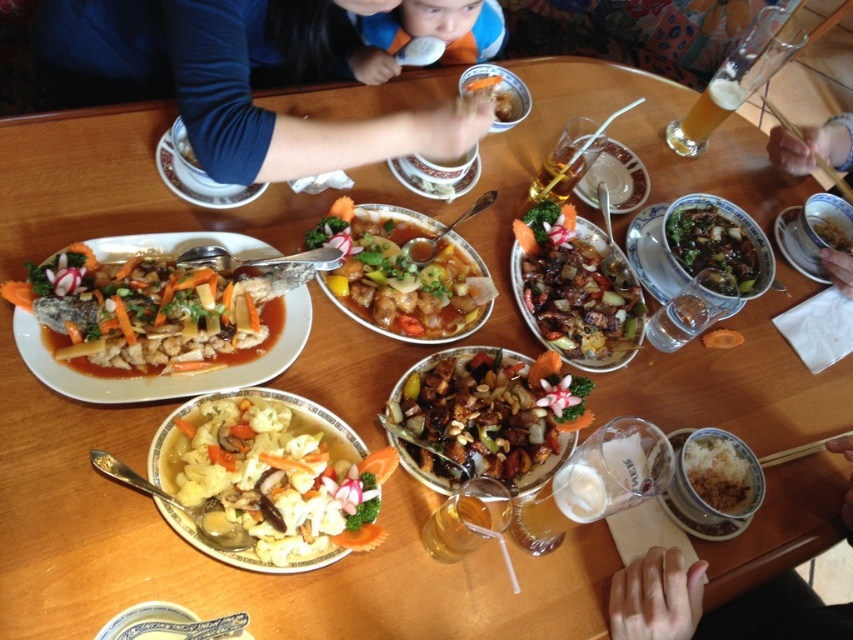
Which is below, white rice at lower right or slightly translucent glass at upper center?

white rice at lower right

Is white rice at lower right positioned at the back of slightly translucent glass at upper center?

No.

Is point (695, 445) less distant than point (496, 92)?

Yes, point (695, 445) is in front of point (496, 92).

You are a GUI agent. You are given a task and a screenshot of the screen. Output one action in this format:
    pyautogui.click(x=<x>, y=<y>)
    Task: Click on the white rice at lower right
    This screenshot has height=640, width=853.
    Given the screenshot: What is the action you would take?
    pyautogui.click(x=712, y=483)

Is white glossy plate at upper center shorter than translucent glass beer at upper right?

In fact, white glossy plate at upper center may be taller than translucent glass beer at upper right.

Is white glossy plate at upper center to the left of translucent glass beer at upper right from the viewer's perspective?

Yes, white glossy plate at upper center is to the left of translucent glass beer at upper right.

Identify the location of white glossy plate at upper center. (196, 173).

This screenshot has width=853, height=640. I want to click on clear glass plate at center, so click(x=614, y=179).

Is point (618, 182) positioned before point (503, 88)?

Yes, point (618, 182) is closer to viewer.

This screenshot has height=640, width=853. I want to click on clear glass plate at center, so click(614, 179).